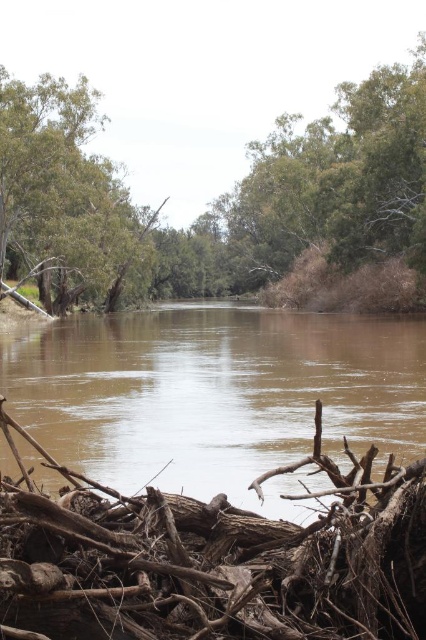
You are standing at the edge of the river and see the brown muddy water at center and the green leafy tree at center. Which object is located to the right of the other?

The brown muddy water at center is positioned on the right side of green leafy tree at center.

You are a photographer trying to capture the brown rough wood at lower center and the green leafy tree at upper left in the same frame. Based on their sizes, which object would appear smaller in the photo?

The brown rough wood at lower center would appear smaller in the photo because its width is less than the green leafy tree at upper left.

You are standing at the edge of the river and notice the brown muddy water at center and the brown rough wood at lower center. Which object is closer to your feet?

The brown rough wood at lower center is closer to your feet because it is located below the brown muddy water at center.